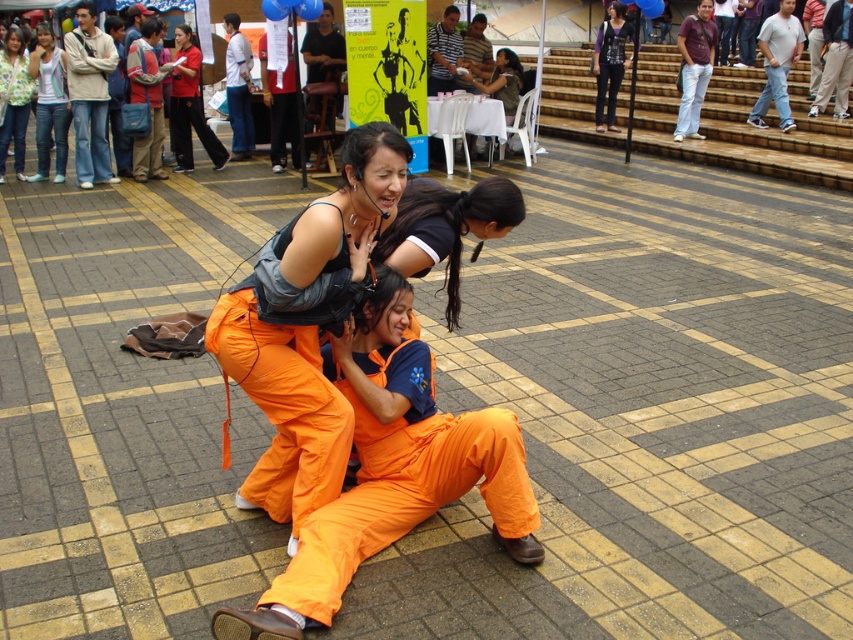
You are a photographer at the event and need to capture a photo of the light blue denim jeans at upper left and matte green jacket at upper left. Which of the two items should you focus on to ensure it fills more of the frame?

The light blue denim jeans at upper left is bigger than the matte green jacket at upper left, so focusing on the light blue denim jeans at upper left will fill more of the frame.